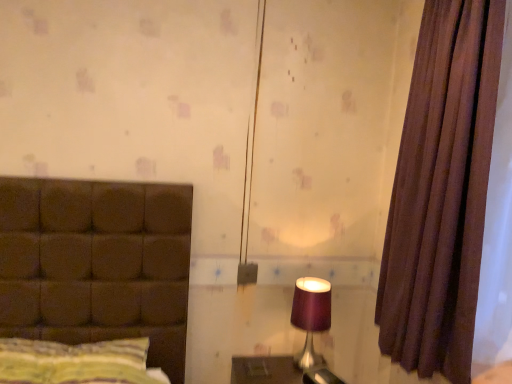
The image size is (512, 384). Find the location of `striped fabric pillow at left`. striped fabric pillow at left is located at coordinates (74, 362).

Where is `striped fabric pillow at left`? striped fabric pillow at left is located at coordinates (74, 362).

Is purple fabric lampshade at right bigger than brown fabric curtain at right?

Actually, purple fabric lampshade at right might be smaller than brown fabric curtain at right.

Which is in front, point (320, 309) or point (442, 261)?

The point (442, 261) is more forward.

How many degrees apart are the facing directions of purple fabric lampshade at right and brown fabric curtain at right?

The angle between the facing direction of purple fabric lampshade at right and the facing direction of brown fabric curtain at right is 88.9 degrees.

Measure the distance between purple fabric lampshade at right and brown fabric curtain at right.

A distance of 52.04 centimeters exists between purple fabric lampshade at right and brown fabric curtain at right.

Does point (74, 376) come behind point (388, 269)?

No, it is in front of (388, 269).

Looking at their sizes, would you say striped fabric pillow at left is wider or thinner than brown fabric curtain at right?

striped fabric pillow at left is wider than brown fabric curtain at right.

Can you confirm if striped fabric pillow at left is taller than brown fabric curtain at right?

Incorrect, the height of striped fabric pillow at left is not larger of that of brown fabric curtain at right.

Which of these two, striped fabric pillow at left or purple fabric lampshade at right, stands taller?

purple fabric lampshade at right.

From a real-world perspective, is striped fabric pillow at left below purple fabric lampshade at right?

Yes, from a real-world perspective, striped fabric pillow at left is below purple fabric lampshade at right.

Is striped fabric pillow at left in contact with purple fabric lampshade at right?

No, striped fabric pillow at left is not in contact with purple fabric lampshade at right.

Is striped fabric pillow at left to the left of purple fabric lampshade at right from the viewer's perspective?

Yes.

Consider the image. Is purple fabric lampshade at right far away from striped fabric pillow at left?

No, purple fabric lampshade at right is not far away from striped fabric pillow at left.

Which object is closer to the camera, purple fabric lampshade at right or striped fabric pillow at left?

striped fabric pillow at left.

Between purple fabric lampshade at right and striped fabric pillow at left, which one has smaller size?

purple fabric lampshade at right.

Which object is positioned more to the left, purple fabric lampshade at right or striped fabric pillow at left?

striped fabric pillow at left.

Is brown fabric curtain at right shorter than purple fabric lampshade at right?

In fact, brown fabric curtain at right may be taller than purple fabric lampshade at right.

Considering the sizes of brown fabric curtain at right and purple fabric lampshade at right in the image, is brown fabric curtain at right wider or thinner than purple fabric lampshade at right?

In the image, brown fabric curtain at right appears to be more narrow than purple fabric lampshade at right.

Measure the distance from brown fabric curtain at right to purple fabric lampshade at right.

brown fabric curtain at right is 20.49 inches away from purple fabric lampshade at right.

Does brown fabric curtain at right have a larger size compared to striped fabric pillow at left?

Yes, brown fabric curtain at right is bigger than striped fabric pillow at left.

How different are the orientations of brown fabric curtain at right and striped fabric pillow at left in degrees?

The facing directions of brown fabric curtain at right and striped fabric pillow at left are 88.7 degrees apart.

From the image's perspective, is brown fabric curtain at right located beneath striped fabric pillow at left?

Actually, brown fabric curtain at right appears above striped fabric pillow at left in the image.

Where is `curtain lying above the purple fabric lampshade at right (from the image's perspective)`? The image size is (512, 384). curtain lying above the purple fabric lampshade at right (from the image's perspective) is located at coordinates (441, 192).

Locate an element on the screen. The image size is (512, 384). pillow to the left of brown fabric curtain at right is located at coordinates (74, 362).

Which object lies further to the anchor point striped fabric pillow at left, brown fabric curtain at right or purple fabric lampshade at right?

The object further to striped fabric pillow at left is brown fabric curtain at right.

Which object lies nearer to the anchor point purple fabric lampshade at right, brown fabric curtain at right or striped fabric pillow at left?

brown fabric curtain at right.

When comparing their distances from brown fabric curtain at right, does purple fabric lampshade at right or striped fabric pillow at left seem closer?

purple fabric lampshade at right is closer to brown fabric curtain at right.

Based on their spatial positions, is striped fabric pillow at left or brown fabric curtain at right further from purple fabric lampshade at right?

Among the two, striped fabric pillow at left is located further to purple fabric lampshade at right.

Estimate the real-world distances between objects in this image. Which object is further from striped fabric pillow at left, purple fabric lampshade at right or brown fabric curtain at right?

Based on the image, brown fabric curtain at right appears to be further to striped fabric pillow at left.

Consider the image. Which object lies further to the anchor point brown fabric curtain at right, striped fabric pillow at left or purple fabric lampshade at right?

striped fabric pillow at left is further to brown fabric curtain at right.

You are a GUI agent. You are given a task and a screenshot of the screen. Output one action in this format:
    pyautogui.click(x=<x>, y=<y>)
    Task: Click on the table lamp situated between striped fabric pillow at left and brown fabric curtain at right from left to right
    The height and width of the screenshot is (384, 512).
    Given the screenshot: What is the action you would take?
    pyautogui.click(x=311, y=316)